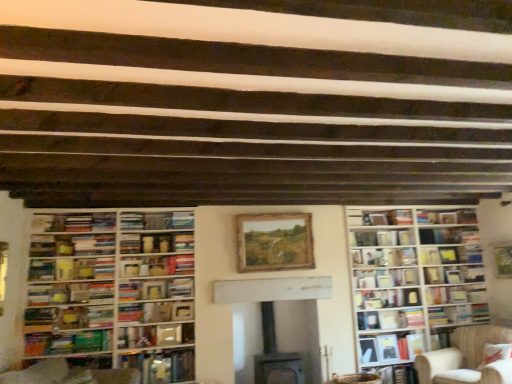
Question: Would you say wooden bookshelf at left, which appears as the second bookcase when viewed from the right, is part of hardcover book at center, arranged as the eighth book when ordered from the bottom,'s contents?

Choices:
 (A) no
 (B) yes

Answer: (A)

Question: Considering the relative sizes of hardcover book at center, arranged as the eighth book when ordered from the bottom, and wooden bookshelf at left, acting as the 1th bookcase starting from the left, in the image provided, is hardcover book at center, arranged as the eighth book when ordered from the bottom, shorter than wooden bookshelf at left, acting as the 1th bookcase starting from the left,?

Choices:
 (A) no
 (B) yes

Answer: (B)

Question: Is hardcover book at center, arranged as the eighth book when ordered from the bottom, wider than wooden bookshelf at left, which appears as the second bookcase when viewed from the right?

Choices:
 (A) no
 (B) yes

Answer: (A)

Question: Is hardcover book at center, arranged as the eighth book when ordered from the bottom, closer to camera compared to wooden bookshelf at left, which appears as the second bookcase when viewed from the right?

Choices:
 (A) yes
 (B) no

Answer: (B)

Question: Are hardcover book at center, arranged as the eighth book when ordered from the bottom, and wooden bookshelf at left, which appears as the second bookcase when viewed from the right, far apart?

Choices:
 (A) yes
 (B) no

Answer: (A)

Question: Considering the positions of hardcover book at lower right, which is the eleventh book in top-to-bottom order, and wooden bookshelf at left, acting as the 1th bookcase starting from the left, in the image, is hardcover book at lower right, which is the eleventh book in top-to-bottom order, bigger or smaller than wooden bookshelf at left, acting as the 1th bookcase starting from the left,?

Choices:
 (A) big
 (B) small

Answer: (B)

Question: In terms of width, does hardcover book at lower right, which is the eleventh book in top-to-bottom order, look wider or thinner when compared to wooden bookshelf at left, which appears as the second bookcase when viewed from the right?

Choices:
 (A) thin
 (B) wide

Answer: (A)

Question: Is hardcover book at lower right, placed as the 2th book when sorted from bottom to top, taller or shorter than wooden bookshelf at left, which appears as the second bookcase when viewed from the right?

Choices:
 (A) tall
 (B) short

Answer: (B)

Question: From the image's perspective, relative to wooden bookshelf at left, which appears as the second bookcase when viewed from the right, is hardcover book at lower right, placed as the 2th book when sorted from bottom to top, above or below?

Choices:
 (A) below
 (B) above

Answer: (A)

Question: Is point (130, 309) positioned closer to the camera than point (150, 339)?

Choices:
 (A) closer
 (B) farther

Answer: (B)

Question: Considering their positions, is hardcover book at center, which is the 7th book in bottom-to-top order, located in front of or behind hardcover book at center, the 4th book ordered from the bottom?

Choices:
 (A) front
 (B) behind

Answer: (B)

Question: Looking at their shapes, would you say hardcover book at center, which is the 7th book in bottom-to-top order, is wider or thinner than hardcover book at center, the 4th book ordered from the bottom?

Choices:
 (A) thin
 (B) wide

Answer: (A)

Question: From the image's perspective, is hardcover book at center, which ranks as the sixth book in top-to-bottom order, above or below hardcover book at center, the 4th book ordered from the bottom?

Choices:
 (A) below
 (B) above

Answer: (B)

Question: Looking at their shapes, would you say hardcover books at center, the 8th book from the top, is wider or thinner than hardcover book at center, the 4th book ordered from the bottom?

Choices:
 (A) thin
 (B) wide

Answer: (B)

Question: Visually, is hardcover books at center, the 8th book from the top, positioned to the left or to the right of hardcover book at center, the ninth book positioned from the top?

Choices:
 (A) left
 (B) right

Answer: (B)